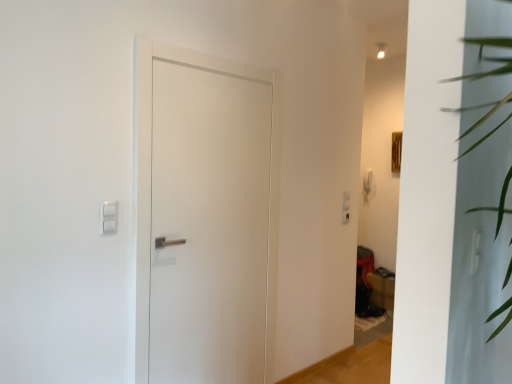
Question: Is white matte door at center smaller than white plastic light switch at upper left?

Choices:
 (A) yes
 (B) no

Answer: (B)

Question: Is white matte door at center further to camera compared to white plastic light switch at upper left?

Choices:
 (A) yes
 (B) no

Answer: (A)

Question: Does white matte door at center turn towards white plastic light switch at upper left?

Choices:
 (A) yes
 (B) no

Answer: (B)

Question: Can you confirm if white matte door at center is shorter than white plastic light switch at upper left?

Choices:
 (A) yes
 (B) no

Answer: (B)

Question: Are white matte door at center and white plastic light switch at upper left far apart?

Choices:
 (A) no
 (B) yes

Answer: (A)

Question: From the image's perspective, is white plastic light switch at upper left above or below white matte door at center?

Choices:
 (A) below
 (B) above

Answer: (B)

Question: Considering the relative positions of white plastic light switch at upper left and white matte door at center in the image provided, is white plastic light switch at upper left to the left or to the right of white matte door at center?

Choices:
 (A) left
 (B) right

Answer: (A)

Question: Is white plastic light switch at upper left situated inside white matte door at center or outside?

Choices:
 (A) outside
 (B) inside

Answer: (A)

Question: From a real-world perspective, is white plastic light switch at upper left above or below white matte door at center?

Choices:
 (A) below
 (B) above

Answer: (B)

Question: Based on their positions, is white plastic light switch at upper left located to the left or right of matte brown cardboard box at lower right?

Choices:
 (A) right
 (B) left

Answer: (B)

Question: Does point (115, 210) appear closer or farther from the camera than point (387, 296)?

Choices:
 (A) farther
 (B) closer

Answer: (B)

Question: From the image's perspective, is white plastic light switch at upper left positioned above or below matte brown cardboard box at lower right?

Choices:
 (A) below
 (B) above

Answer: (B)

Question: Considering the positions of white plastic light switch at upper left and matte brown cardboard box at lower right in the image, is white plastic light switch at upper left taller or shorter than matte brown cardboard box at lower right?

Choices:
 (A) tall
 (B) short

Answer: (B)

Question: From a real-world perspective, is white matte door at center above or below matte brown cardboard box at lower right?

Choices:
 (A) above
 (B) below

Answer: (A)

Question: Looking at their shapes, would you say white matte door at center is wider or thinner than matte brown cardboard box at lower right?

Choices:
 (A) thin
 (B) wide

Answer: (A)